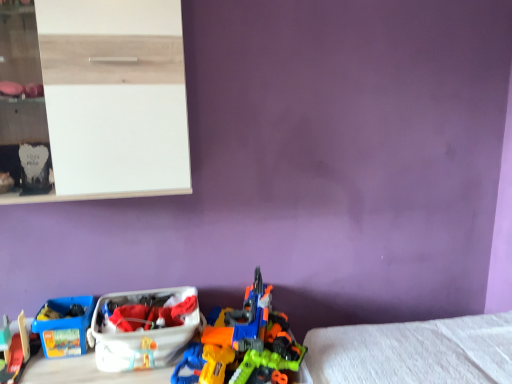
The height and width of the screenshot is (384, 512). Describe the element at coordinates (106, 100) in the screenshot. I see `white glossy shelf at upper left` at that location.

I want to click on white glossy shelf at upper left, so click(106, 100).

At what (x,y) coordinates should I click in order to perform the action: click on orange plastic toy gun at center, which is the 1th toy in right-to-left order. Please return your answer as a coordinate pair (x, y). The width and height of the screenshot is (512, 384). Looking at the image, I should click on (243, 344).

What do you see at coordinates (143, 327) in the screenshot?
I see `white plastic storage box at lower left, positioned as the 2th storage box in left-to-right order` at bounding box center [143, 327].

This screenshot has width=512, height=384. What are the coordinates of `white glossy shelf at upper left` in the screenshot? It's located at (106, 100).

Considering the sizes of objects white glossy shelf at upper left and white plastic storage box at lower left, positioned as the 2th storage box in left-to-right order, in the image provided, who is taller, white glossy shelf at upper left or white plastic storage box at lower left, positioned as the 2th storage box in left-to-right order,?

Standing taller between the two is white glossy shelf at upper left.

From a real-world perspective, between white glossy shelf at upper left and white plastic storage box at lower left, which appears as the first storage box when viewed from the right, who is vertically higher?

In real-world perspective, white glossy shelf at upper left is above.

Who is bigger, white glossy shelf at upper left or white plastic storage box at lower left, positioned as the 2th storage box in left-to-right order?

With larger size is white glossy shelf at upper left.

Is point (246, 303) more distant than point (180, 287)?

That is False.

Visually, is orange plastic toy gun at center, the 2th toy positioned from the left, positioned to the left or to the right of white plastic storage box at lower left, positioned as the 2th storage box in left-to-right order?

orange plastic toy gun at center, the 2th toy positioned from the left, is to the right of white plastic storage box at lower left, positioned as the 2th storage box in left-to-right order.

Which is correct: orange plastic toy gun at center, which is the 1th toy in right-to-left order, is inside white plastic storage box at lower left, positioned as the 2th storage box in left-to-right order, or outside of it?

orange plastic toy gun at center, which is the 1th toy in right-to-left order, cannot be found inside white plastic storage box at lower left, positioned as the 2th storage box in left-to-right order.

Which object is closer to the camera, white plastic storage box at lower left, positioned as the 2th storage box in left-to-right order, or orange plastic toy gun at center, which is the 1th toy in right-to-left order?

orange plastic toy gun at center, which is the 1th toy in right-to-left order.

Considering the points (117, 334) and (248, 317), which point is behind, point (117, 334) or point (248, 317)?

Positioned behind is point (248, 317).

From a real-world perspective, between white plastic storage box at lower left, which appears as the first storage box when viewed from the right, and orange plastic toy gun at center, the 2th toy positioned from the left, who is vertically higher?

orange plastic toy gun at center, the 2th toy positioned from the left, is physically above.

Is white plastic storage box at lower left, positioned as the 2th storage box in left-to-right order, thinner than orange plastic toy gun at center, which is the 1th toy in right-to-left order?

Correct, the width of white plastic storage box at lower left, positioned as the 2th storage box in left-to-right order, is less than that of orange plastic toy gun at center, which is the 1th toy in right-to-left order.

Can we say orange plastic toy gun at center, the 2th toy positioned from the left, lies outside blue plastic storage box at lower left, the 1th storage box in the left-to-right sequence?

Yes, orange plastic toy gun at center, the 2th toy positioned from the left, is not within blue plastic storage box at lower left, the 1th storage box in the left-to-right sequence.

From the image's perspective, is orange plastic toy gun at center, the 2th toy positioned from the left, under blue plastic storage box at lower left, which is the 2th storage box in right-to-left order?

Incorrect, from the image's perspective, orange plastic toy gun at center, the 2th toy positioned from the left, is higher than blue plastic storage box at lower left, which is the 2th storage box in right-to-left order.

Measure the distance between orange plastic toy gun at center, the 2th toy positioned from the left, and blue plastic storage box at lower left, the 1th storage box in the left-to-right sequence.

orange plastic toy gun at center, the 2th toy positioned from the left, is 23.34 inches away from blue plastic storage box at lower left, the 1th storage box in the left-to-right sequence.

Is orange plastic toy gun at center, the 2th toy positioned from the left, smaller than blue plastic storage box at lower left, which is the 2th storage box in right-to-left order?

No, orange plastic toy gun at center, the 2th toy positioned from the left, is not smaller than blue plastic storage box at lower left, which is the 2th storage box in right-to-left order.

Based on the photo, could orange plastic toy gun at center, which is the 1th toy in right-to-left order, be considered to be inside blue plastic storage box at lower left, the 1th storage box in the left-to-right sequence?

No, orange plastic toy gun at center, which is the 1th toy in right-to-left order, is located outside of blue plastic storage box at lower left, the 1th storage box in the left-to-right sequence.

Is blue plastic storage box at lower left, which is the 2th storage box in right-to-left order, facing towards orange plastic toy gun at center, which is the 1th toy in right-to-left order?

No, blue plastic storage box at lower left, which is the 2th storage box in right-to-left order, is not turned towards orange plastic toy gun at center, which is the 1th toy in right-to-left order.

From the image's perspective, is white glossy shelf at upper left beneath smooth plastic toy train at lower left, the 2th toy when ordered from right to left?

No, from the image's perspective, white glossy shelf at upper left is not below smooth plastic toy train at lower left, the 2th toy when ordered from right to left.

Is white glossy shelf at upper left oriented towards smooth plastic toy train at lower left, which is the first toy from left to right?

No, white glossy shelf at upper left is not oriented towards smooth plastic toy train at lower left, which is the first toy from left to right.

From a real-world perspective, count 2nd toys downward from the white glossy shelf at upper left and point to it. Please provide its 2D coordinates.

[(16, 353)]

Would you say smooth plastic toy train at lower left, the 2th toy when ordered from right to left, contains white plastic storage box at lower left, which appears as the first storage box when viewed from the right?

No, white plastic storage box at lower left, which appears as the first storage box when viewed from the right, is not surrounded by smooth plastic toy train at lower left, the 2th toy when ordered from right to left.

Is smooth plastic toy train at lower left, the 2th toy when ordered from right to left, in front of or behind white plastic storage box at lower left, positioned as the 2th storage box in left-to-right order, in the image?

In the image, smooth plastic toy train at lower left, the 2th toy when ordered from right to left, appears in front of white plastic storage box at lower left, positioned as the 2th storage box in left-to-right order.

In the scene shown: Is smooth plastic toy train at lower left, the 2th toy when ordered from right to left, with white plastic storage box at lower left, which appears as the first storage box when viewed from the right?

No, smooth plastic toy train at lower left, the 2th toy when ordered from right to left, is not touching white plastic storage box at lower left, which appears as the first storage box when viewed from the right.

At what (x,y) coordinates should I click in order to perform the action: click on shelf located above the white plastic storage box at lower left, which appears as the first storage box when viewed from the right (from the image's perspective). Please return your answer as a coordinate pair (x, y). Looking at the image, I should click on (106, 100).

Where is `toy on the right of white plastic storage box at lower left, which appears as the first storage box when viewed from the right`? The image size is (512, 384). toy on the right of white plastic storage box at lower left, which appears as the first storage box when viewed from the right is located at coordinates (243, 344).

Looking at the image, which one is located further to blue plastic storage box at lower left, the 1th storage box in the left-to-right sequence, smooth plastic toy train at lower left, the 2th toy when ordered from right to left, or white plastic storage box at lower left, which appears as the first storage box when viewed from the right?

white plastic storage box at lower left, which appears as the first storage box when viewed from the right, is positioned further to the anchor blue plastic storage box at lower left, the 1th storage box in the left-to-right sequence.

Estimate the real-world distances between objects in this image. Which object is further from white plastic storage box at lower left, which appears as the first storage box when viewed from the right, white glossy shelf at upper left or blue plastic storage box at lower left, which is the 2th storage box in right-to-left order?

white glossy shelf at upper left.

Considering their positions, is blue plastic storage box at lower left, the 1th storage box in the left-to-right sequence, positioned further to white glossy shelf at upper left than white plastic storage box at lower left, positioned as the 2th storage box in left-to-right order?

blue plastic storage box at lower left, the 1th storage box in the left-to-right sequence, is further to white glossy shelf at upper left.

From the picture: Based on their spatial positions, is blue plastic storage box at lower left, which is the 2th storage box in right-to-left order, or white glossy shelf at upper left closer to orange plastic toy gun at center, the 2th toy positioned from the left?

blue plastic storage box at lower left, which is the 2th storage box in right-to-left order.

Based on their spatial positions, is smooth plastic toy train at lower left, the 2th toy when ordered from right to left, or blue plastic storage box at lower left, the 1th storage box in the left-to-right sequence, closer to white glossy shelf at upper left?

blue plastic storage box at lower left, the 1th storage box in the left-to-right sequence, is closer to white glossy shelf at upper left.

Considering their positions, is orange plastic toy gun at center, which is the 1th toy in right-to-left order, positioned closer to smooth plastic toy train at lower left, the 2th toy when ordered from right to left, than blue plastic storage box at lower left, which is the 2th storage box in right-to-left order?

blue plastic storage box at lower left, which is the 2th storage box in right-to-left order, is positioned closer to the anchor smooth plastic toy train at lower left, the 2th toy when ordered from right to left.

From the image, which object appears to be farther from white plastic storage box at lower left, which appears as the first storage box when viewed from the right, blue plastic storage box at lower left, which is the 2th storage box in right-to-left order, or white glossy shelf at upper left?

white glossy shelf at upper left lies further to white plastic storage box at lower left, which appears as the first storage box when viewed from the right, than the other object.

Which object lies further to the anchor point orange plastic toy gun at center, which is the 1th toy in right-to-left order, white glossy shelf at upper left or white plastic storage box at lower left, positioned as the 2th storage box in left-to-right order?

white glossy shelf at upper left.

The height and width of the screenshot is (384, 512). Identify the location of storage box situated between blue plastic storage box at lower left, which is the 2th storage box in right-to-left order, and orange plastic toy gun at center, the 2th toy positioned from the left, from left to right. (143, 327).

In order to click on toy between white glossy shelf at upper left and white plastic storage box at lower left, which appears as the first storage box when viewed from the right, from top to bottom in this screenshot , I will do `click(243, 344)`.

Locate an element on the screen. toy between white glossy shelf at upper left and blue plastic storage box at lower left, which is the 2th storage box in right-to-left order, vertically is located at coordinates (243, 344).

The width and height of the screenshot is (512, 384). What are the coordinates of `storage box that lies between white glossy shelf at upper left and blue plastic storage box at lower left, the 1th storage box in the left-to-right sequence, from top to bottom` in the screenshot? It's located at (143, 327).